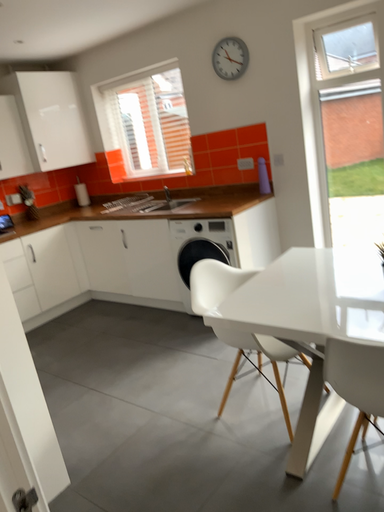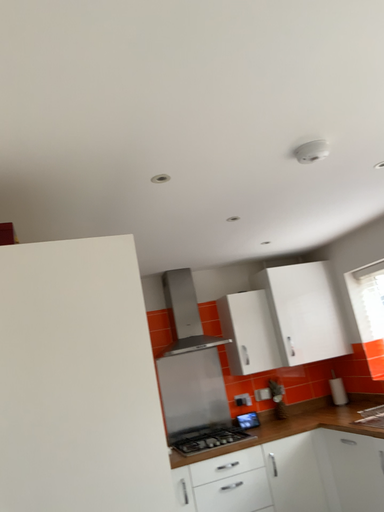
Question: How did the camera likely rotate when shooting the video?

Choices:
 (A) rotated upward
 (B) rotated downward

Answer: (A)